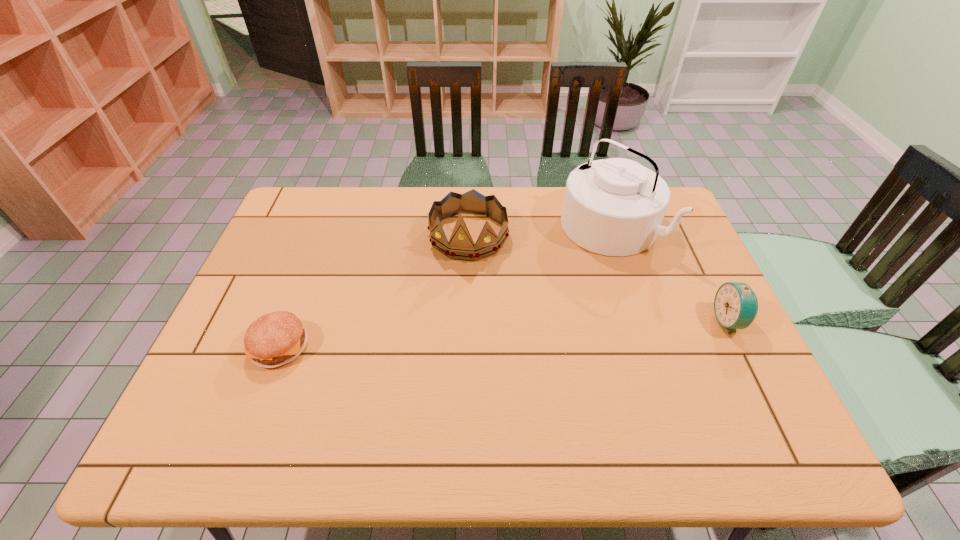
Locate which object ranks third in proximity to the second object from left to right. Please provide its 2D coordinates. Your answer should be formatted as a tuple, i.e. [(x, y)], where the tuple contains the x and y coordinates of a point satisfying the conditions above.

[(735, 305)]

This screenshot has width=960, height=540. Identify the location of vacant space that satisfies the following two spatial constraints: 1. on the back side of the kettle; 2. on the right side of the third object from right to left. (468, 227).